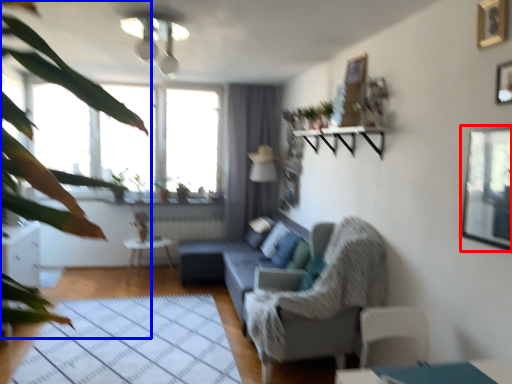
Question: Which object is closer to the camera taking this photo, window screen (highlighted by a red box) or vegetation (highlighted by a blue box)?

Choices:
 (A) window screen
 (B) vegetation

Answer: (B)